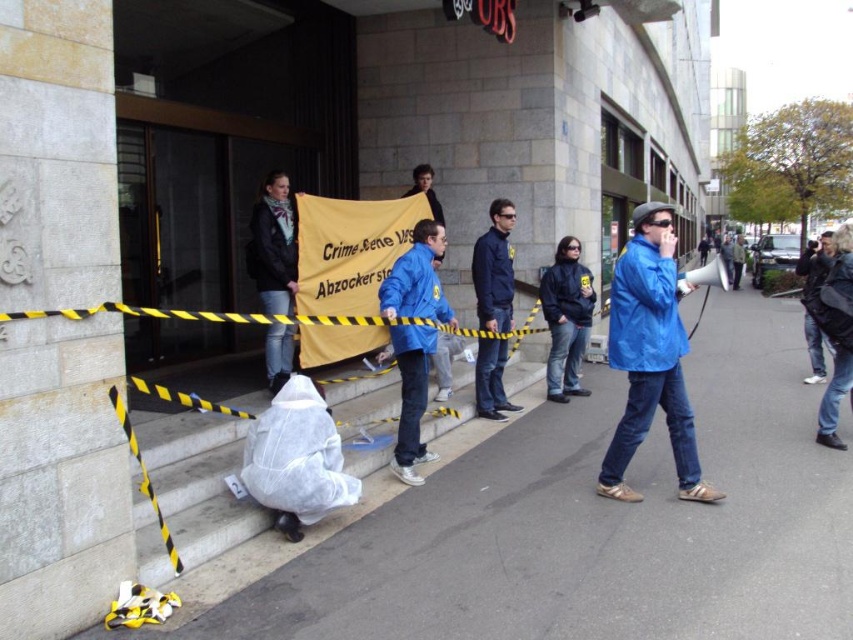
Question: Which is nearer to the gray concrete pavement at lower left?

Choices:
 (A) blue matte jacket at right
 (B) white plastic bag at lower center
 (C) denim jacket at lower right
 (D) dark blue jacket at center

Answer: (D)

Question: Can you confirm if white plastic bag at lower center is bigger than blue fabric jacket at center?

Choices:
 (A) no
 (B) yes

Answer: (A)

Question: Which point is closer to the camera taking this photo?

Choices:
 (A) (708, 620)
 (B) (583, 330)
 (C) (799, 275)
 (D) (424, 326)

Answer: (A)

Question: Can you confirm if blue fabric jacket at center is wider than blue jacket at center?

Choices:
 (A) no
 (B) yes

Answer: (B)

Question: Which object appears farthest from the camera in this image?

Choices:
 (A) denim jacket at lower right
 (B) gray concrete pavement at lower left
 (C) blue jacket at center
 (D) dark blue jacket at center

Answer: (D)

Question: Does white plastic bag at lower center have a lesser width compared to black leather jacket at upper right?

Choices:
 (A) no
 (B) yes

Answer: (A)